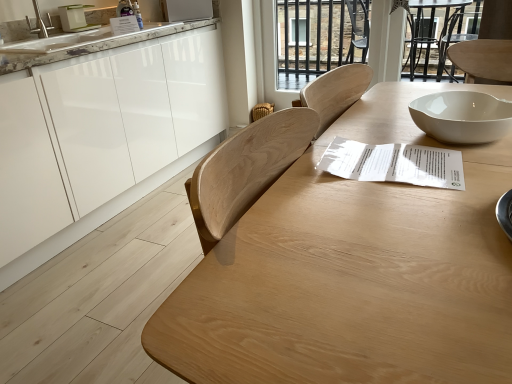
This screenshot has width=512, height=384. Identify the location of free space in front of white paper at center. (404, 218).